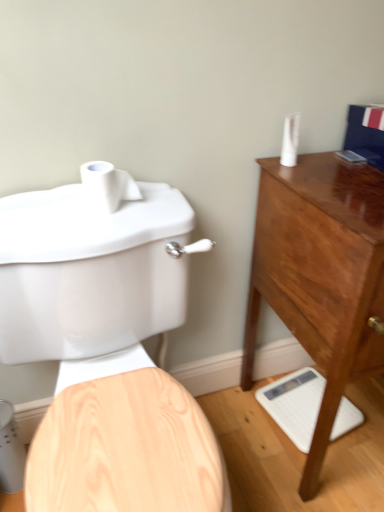
Image resolution: width=384 pixels, height=512 pixels. I want to click on free space to the left of white glossy scale at lower right, so [x=246, y=425].